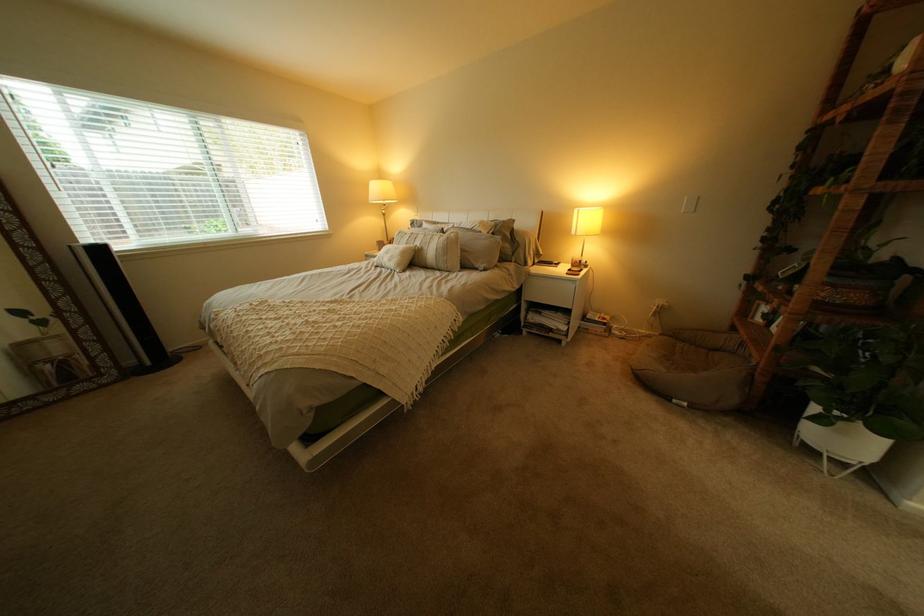
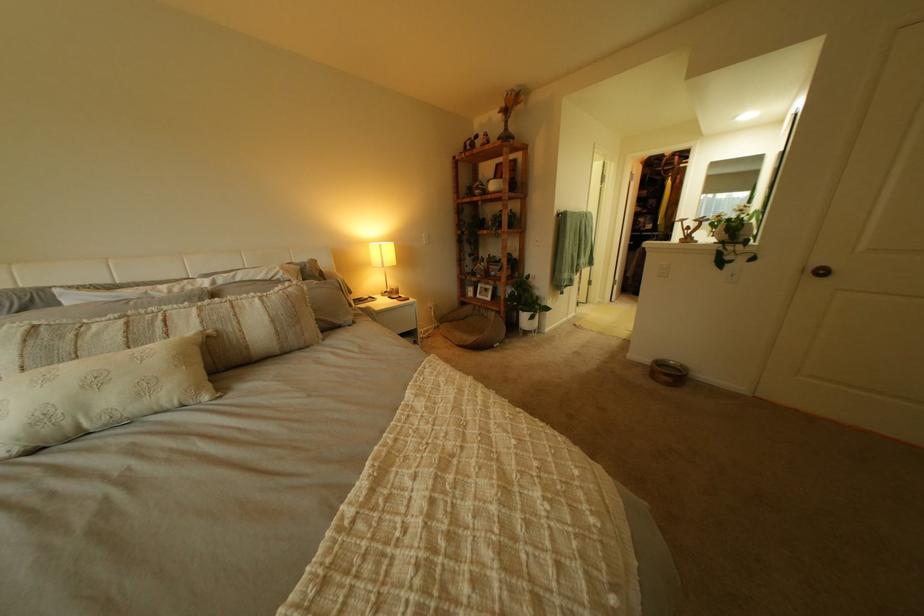
Locate, in the second image, the point that corresponds to [435,243] in the first image.

(213, 323)